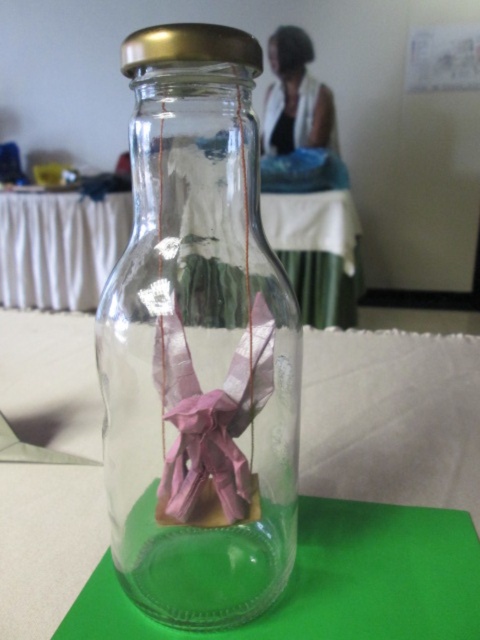
Who is positioned more to the left, transparent glass bottle at center or transparent glass table at center?

Positioned to the left is transparent glass table at center.

Does point (106, 397) come closer to viewer compared to point (70, 248)?

Yes, it is.

Who is more forward, (167,266) or (316,202)?

Positioned in front is point (167,266).

What are the coordinates of `transparent glass bottle at center` in the screenshot? It's located at (199, 342).

Which is more to the right, transparent glass table at center or pink paper ribbon at center?

pink paper ribbon at center

Which is in front, point (55, 209) or point (260, 333)?

Point (260, 333) is in front.

What do you see at coordinates (60, 248) in the screenshot? I see `transparent glass table at center` at bounding box center [60, 248].

You are a GUI agent. You are given a task and a screenshot of the screen. Output one action in this format:
    pyautogui.click(x=<x>, y=<y>)
    Task: Click on the transparent glass table at center
    
    Given the screenshot: What is the action you would take?
    coord(60,248)

Is point (175, 378) positioned in front of point (165, 406)?

That is True.

This screenshot has height=640, width=480. Describe the element at coordinates (199, 342) in the screenshot. I see `transparent glass bottle at center` at that location.

The height and width of the screenshot is (640, 480). Identify the location of transparent glass bottle at center. (199, 342).